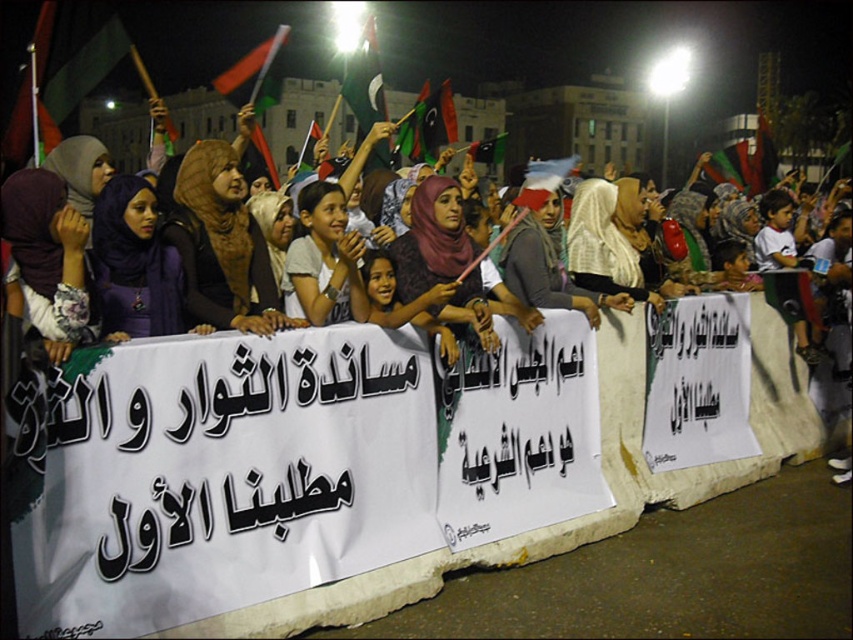
Which of these two, brown fabric hijab at center or purple matte hijab at center, stands shorter?

With less height is purple matte hijab at center.

Can you confirm if brown fabric hijab at center is thinner than purple matte hijab at center?

No, brown fabric hijab at center is not thinner than purple matte hijab at center.

Identify the location of brown fabric hijab at center. Image resolution: width=853 pixels, height=640 pixels. (219, 244).

The height and width of the screenshot is (640, 853). In order to click on white fabric banner at center in this screenshot , I will do `click(74, 246)`.

Does point (380, 131) come behind point (299, 214)?

Yes, it is behind point (299, 214).

Find the location of a particular element. white fabric banner at center is located at coordinates (74, 246).

Between purple matte hijab at center and light gray fabric at center, which one has less height?

purple matte hijab at center is shorter.

Is purple matte hijab at center bigger than light gray fabric at center?

Incorrect, purple matte hijab at center is not larger than light gray fabric at center.

Who is more distant from viewer, (161, 248) or (317, 202)?

Point (317, 202)

The image size is (853, 640). In order to click on purple matte hijab at center in this screenshot , I will do `click(134, 262)`.